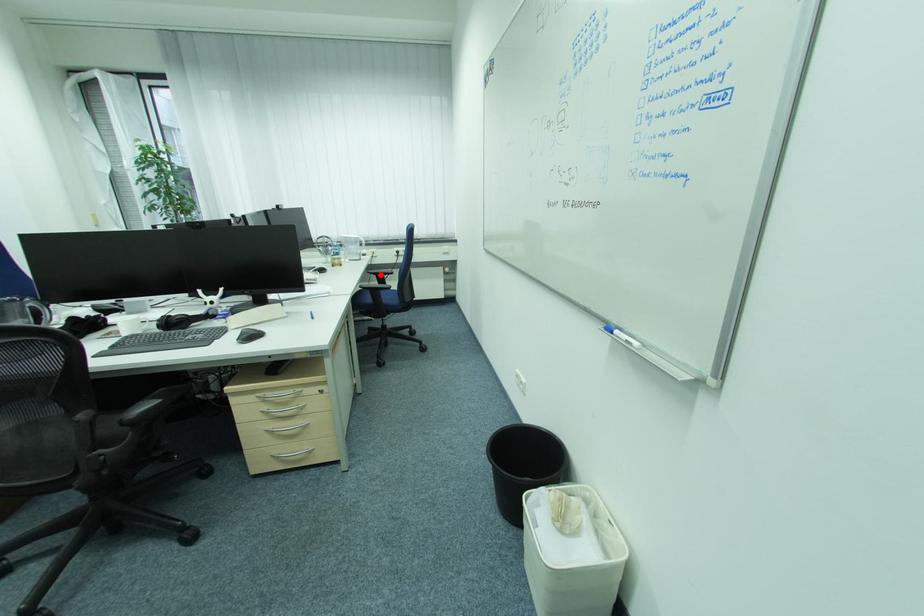
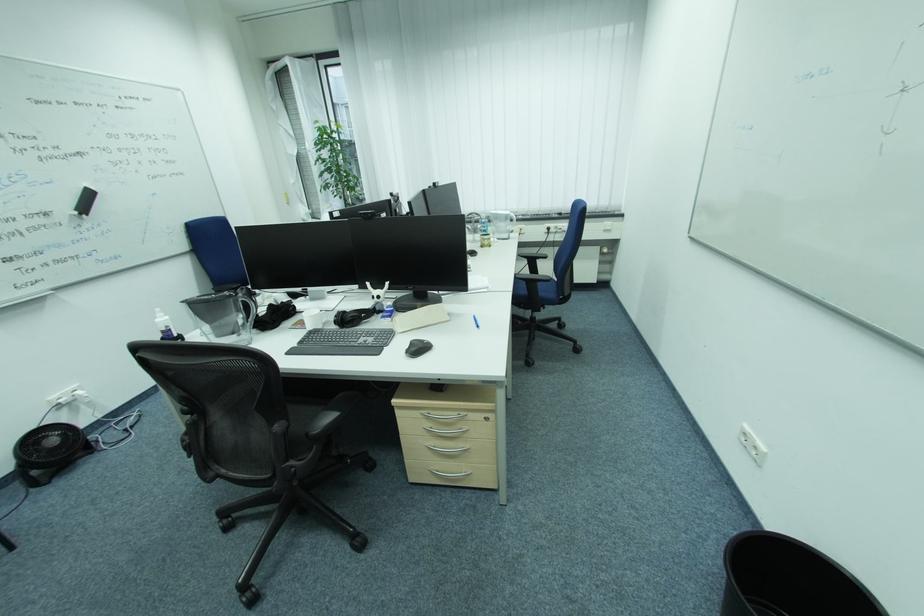
Question: I am providing you with two images of the same scene from different viewpoints. A red point is shown in image1. For the corresponding object point in image2, is it positioned nearer or farther from the camera?

Choices:
 (A) Nearer
 (B) Farther

Answer: (B)